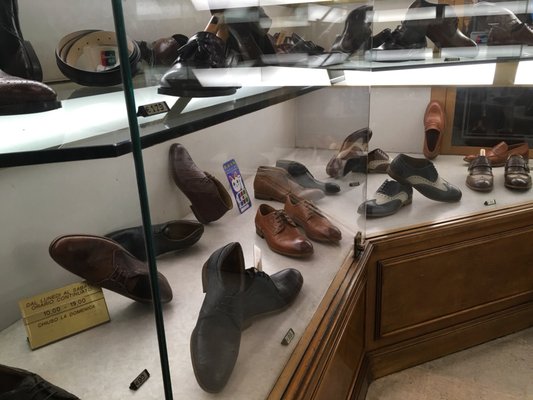
You are a GUI agent. You are given a task and a screenshot of the screen. Output one action in this format:
    pyautogui.click(x=<x>, y=<y>)
    Task: Click on the floor
    
    Given the screenshot: What is the action you would take?
    (487, 371)